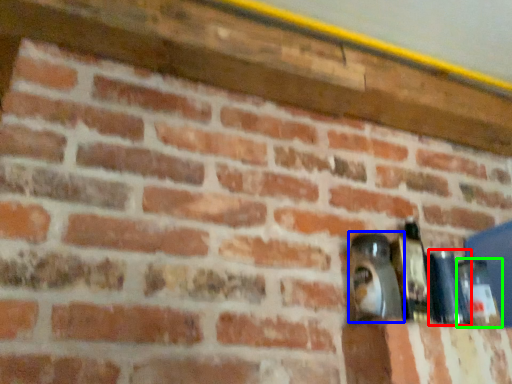
Question: Which object is the closest to the bottle (highlighted by a red box)? Choose among these: bottle (highlighted by a blue box) or bottle (highlighted by a green box).

Choices:
 (A) bottle
 (B) bottle

Answer: (B)